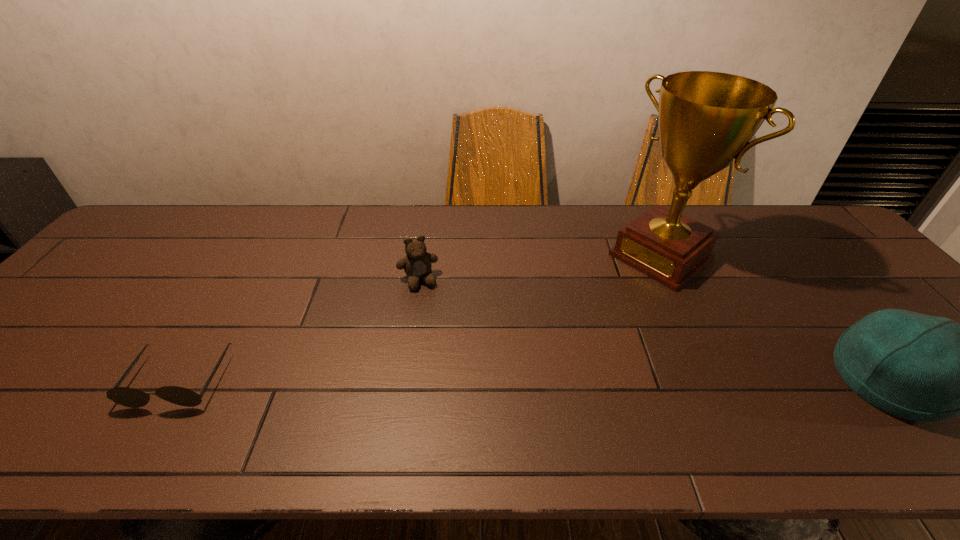
Where is `vacant spot on the desktop that is between the leftmost object and the second tallest object and is positioned on the plaque of the award`? This screenshot has height=540, width=960. vacant spot on the desktop that is between the leftmost object and the second tallest object and is positioned on the plaque of the award is located at coordinates (501, 380).

Find the location of a particular element. Image resolution: width=960 pixels, height=540 pixels. free space on the desktop that is between the sunglasses and the third shortest object and is positioned on the face of the second shortest object is located at coordinates (451, 380).